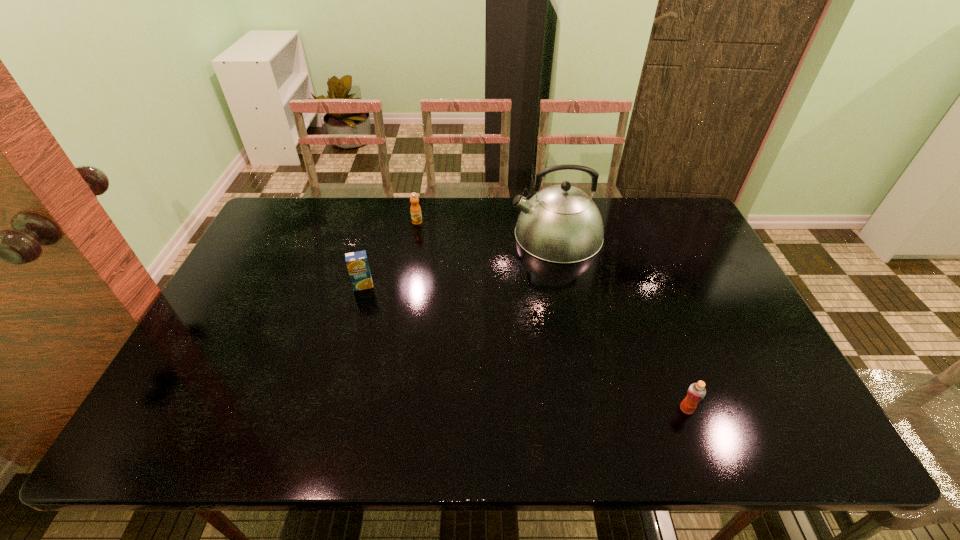
Identify the location of free space located 0.240m from the spout of the kettle. The image size is (960, 540). 438,235.

You are a GUI agent. You are given a task and a screenshot of the screen. Output one action in this format:
    pyautogui.click(x=<x>, y=<y>)
    Task: Click on the vacant space situated on the right of the second farthest orange juice
    The height and width of the screenshot is (540, 960).
    Given the screenshot: What is the action you would take?
    pyautogui.click(x=398, y=285)

You are a GUI agent. You are given a task and a screenshot of the screen. Output one action in this format:
    pyautogui.click(x=<x>, y=<y>)
    Task: Click on the vacant region located 0.340m on the front label of the third object from right to left
    The image size is (960, 540).
    Given the screenshot: What is the action you would take?
    pyautogui.click(x=404, y=299)

I want to click on vacant space located 0.280m on the back of the rightmost object, so click(650, 311).

Identify the location of kettle present at the far edge. (561, 224).

Where is `orange juice present at the far edge`? The height and width of the screenshot is (540, 960). orange juice present at the far edge is located at coordinates (416, 216).

Where is `object that is positioned at the near edge`? This screenshot has width=960, height=540. object that is positioned at the near edge is located at coordinates (696, 392).

The width and height of the screenshot is (960, 540). I want to click on vacant space at the far edge of the desktop, so click(446, 210).

Identify the location of free space at the near edge. (448, 430).

You are a GUI agent. You are given a task and a screenshot of the screen. Output one action in this format:
    pyautogui.click(x=<x>, y=<y>)
    Task: Click on the vacant region at the left edge of the desktop
    The width and height of the screenshot is (960, 540).
    Given the screenshot: What is the action you would take?
    pyautogui.click(x=261, y=280)